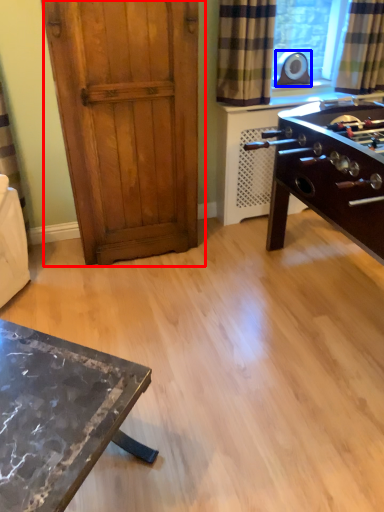
Question: Which of the following is the closest to the observer, door (highlighted by a red box) or appliance (highlighted by a blue box)?

Choices:
 (A) door
 (B) appliance

Answer: (A)